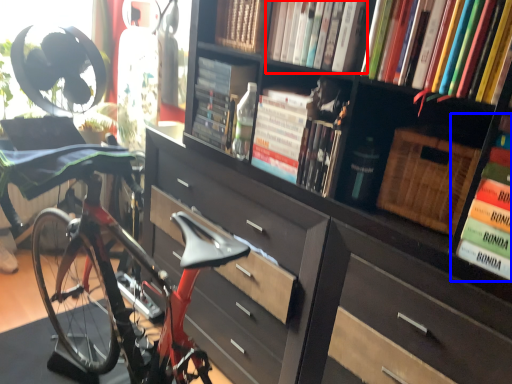
Question: Which of the following is the farthest to the observer, book (highlighted by a red box) or book (highlighted by a blue box)?

Choices:
 (A) book
 (B) book

Answer: (A)